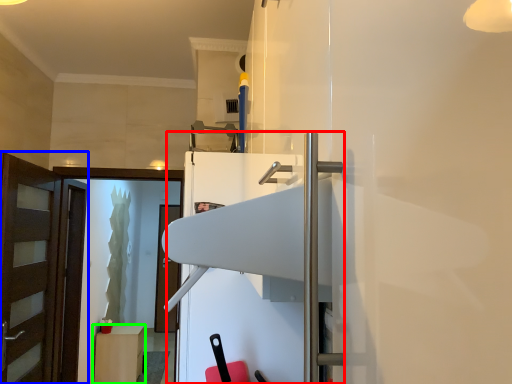
Question: Which object is the farthest from fridge (highlighted by a red box)? Choose among these: door (highlighted by a blue box) or cabinetry (highlighted by a green box).

Choices:
 (A) door
 (B) cabinetry

Answer: (B)